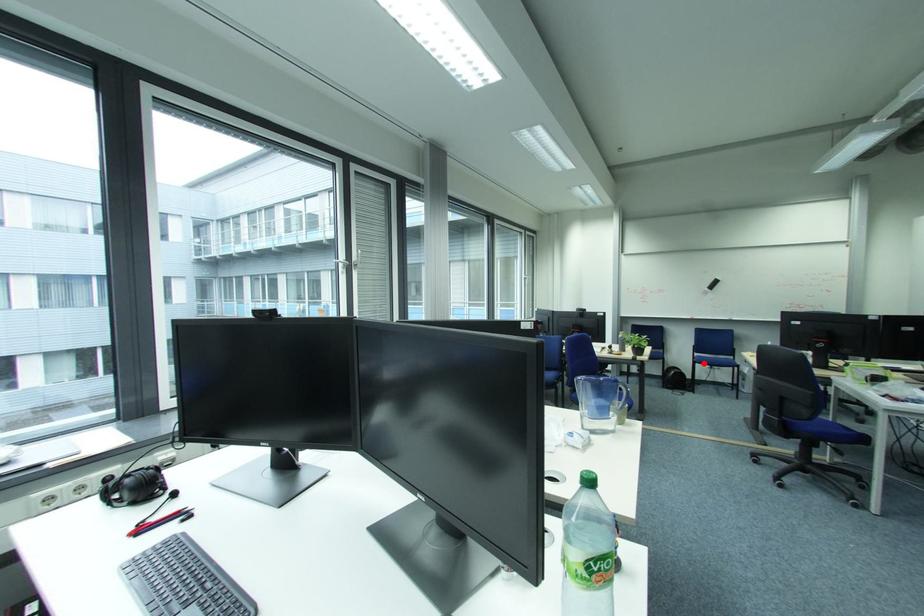
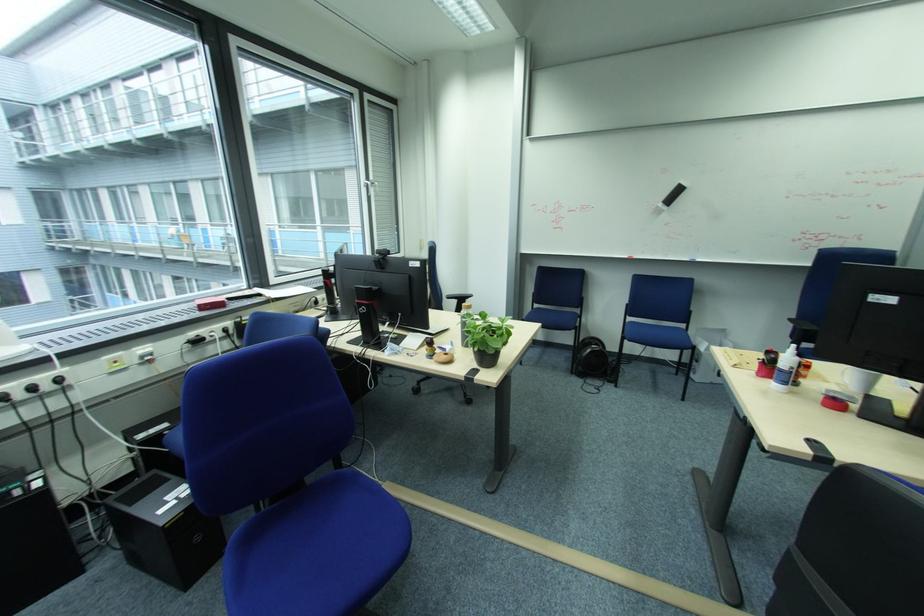
In the second image, find the point that corresponds to the highlighted location in the first image.

(633, 339)